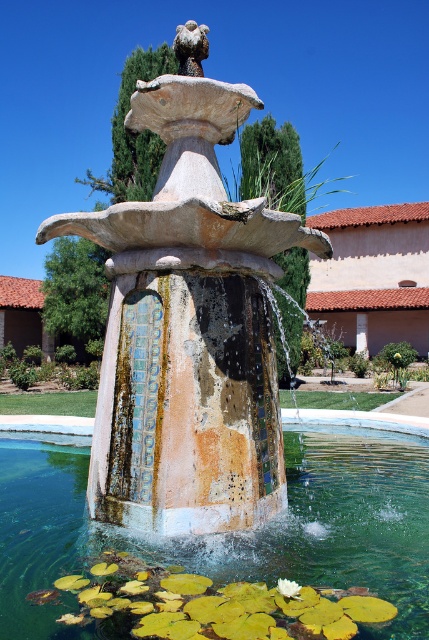
Question: Which point is closer to the camera?

Choices:
 (A) translucent glass bowl at center
 (B) mosaic stone fountain at center

Answer: (A)

Question: Which point is farther to the camera?

Choices:
 (A) mosaic stone fountain at center
 (B) translucent glass bowl at center

Answer: (A)

Question: Does mosaic stone fountain at center have a smaller size compared to translucent glass bowl at center?

Choices:
 (A) no
 (B) yes

Answer: (B)

Question: Can you confirm if mosaic stone fountain at center is wider than translucent glass bowl at center?

Choices:
 (A) no
 (B) yes

Answer: (A)

Question: Observing the image, what is the correct spatial positioning of mosaic stone fountain at center in reference to translucent glass bowl at center?

Choices:
 (A) left
 (B) right

Answer: (B)